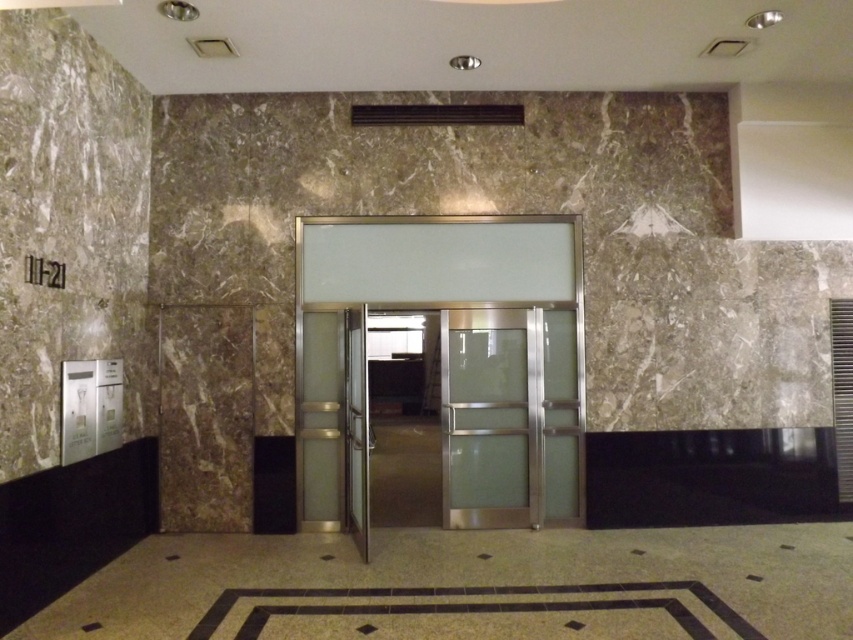
Question: Can you confirm if satin glass elevator doors at center is positioned to the right of clear glass door at center?

Choices:
 (A) no
 (B) yes

Answer: (A)

Question: Is satin glass elevator doors at center bigger than clear glass door at center?

Choices:
 (A) yes
 (B) no

Answer: (A)

Question: Does satin glass elevator doors at center lie in front of clear glass door at center?

Choices:
 (A) no
 (B) yes

Answer: (B)

Question: Which point is farther to the camera?

Choices:
 (A) clear glass door at center
 (B) satin glass elevator doors at center

Answer: (A)

Question: Which point appears closest to the camera in this image?

Choices:
 (A) (502, 332)
 (B) (482, 365)

Answer: (B)